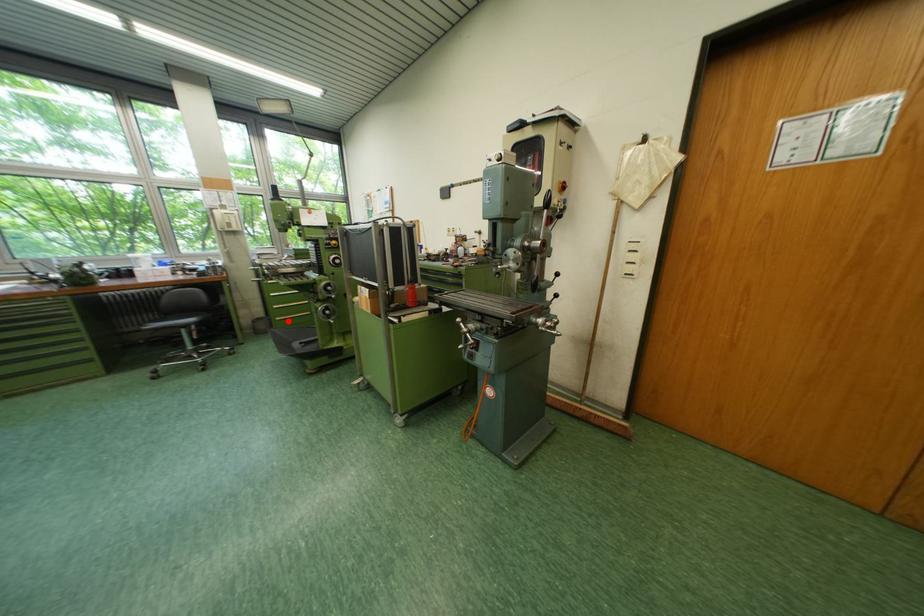
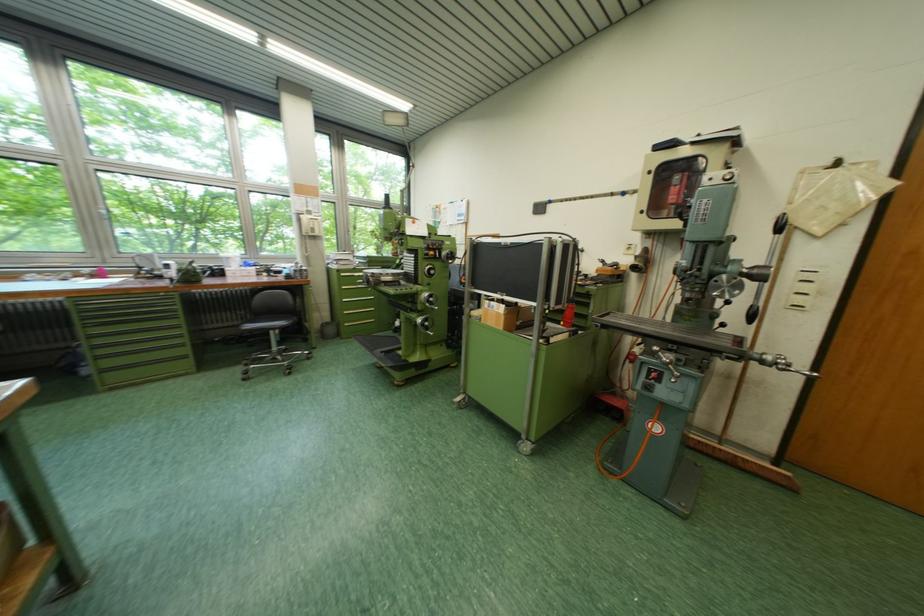
Question: I am providing you with two images of the same scene from different viewpoints. A red point is shown in image1. For the corresponding object point in image2, is it positioned nearer or farther from the camera?

Choices:
 (A) Nearer
 (B) Farther

Answer: (A)